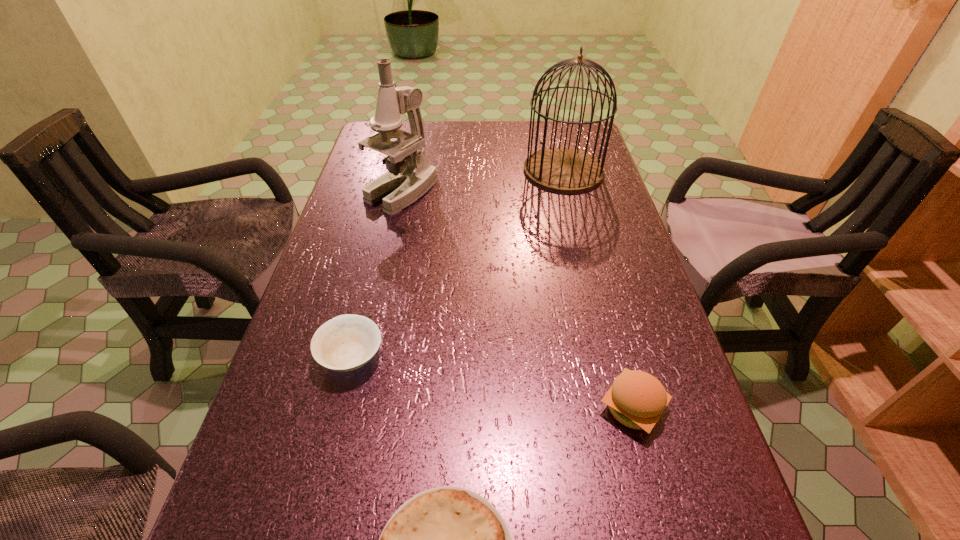
What are the coordinates of `microscope` in the screenshot? It's located at (410, 175).

I want to click on birdcage, so click(x=565, y=170).

This screenshot has height=540, width=960. I want to click on the third shortest object, so click(636, 399).

At what (x,y) coordinates should I click in order to perform the action: click on the second shortest object. Please return your answer as a coordinate pair (x, y). Image resolution: width=960 pixels, height=540 pixels. Looking at the image, I should click on (347, 342).

This screenshot has height=540, width=960. I want to click on vacant space situated 0.270m on the back of the microscope, so click(416, 129).

Locate an element on the screen. The image size is (960, 540). vacant position located 0.270m at the door of the birdcage is located at coordinates (586, 257).

Locate an element on the screen. vacant position located 0.130m on the front of the third shortest object is located at coordinates (664, 528).

Find the location of `vacant space located on the right of the fourth tallest object`. vacant space located on the right of the fourth tallest object is located at coordinates (456, 356).

This screenshot has width=960, height=540. Identify the location of object at the far edge. (565, 170).

Locate an element on the screen. Image resolution: width=960 pixels, height=540 pixels. microscope positioned at the left edge is located at coordinates (410, 175).